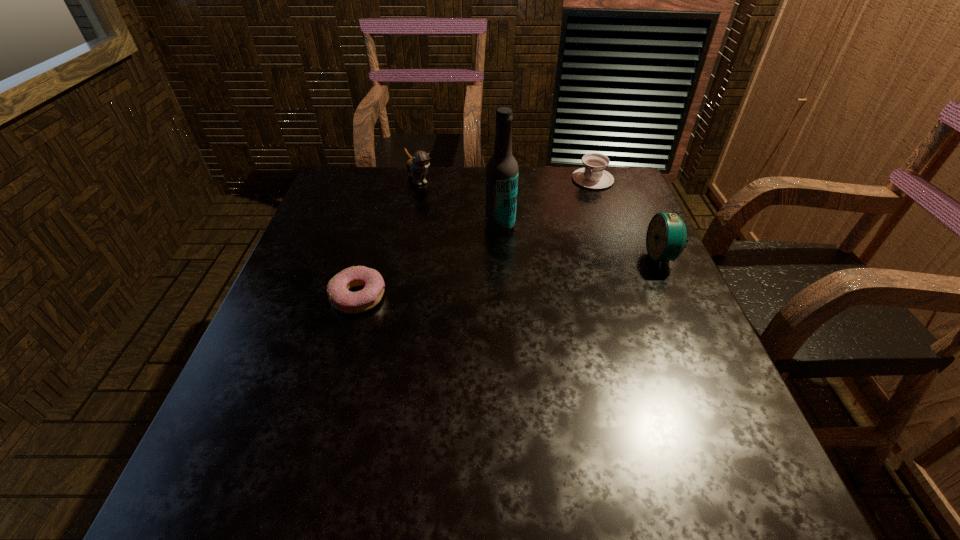
At what (x,y) coordinates should I click in order to perform the action: click on vacant space located on the handle side of the teacup. Please return your answer as a coordinate pair (x, y). Image resolution: width=960 pixels, height=540 pixels. Looking at the image, I should click on (559, 245).

Image resolution: width=960 pixels, height=540 pixels. In order to click on free region located on the handle side of the teacup in this screenshot , I will do `click(580, 205)`.

Locate an element on the screen. This screenshot has width=960, height=540. kitten that is at the far edge is located at coordinates (417, 165).

This screenshot has height=540, width=960. In order to click on teacup located in the far edge section of the desktop in this screenshot , I will do `click(593, 176)`.

Find the location of a particular element. The height and width of the screenshot is (540, 960). object at the left edge is located at coordinates pyautogui.click(x=343, y=300).

You are a GUI agent. You are given a task and a screenshot of the screen. Output one action in this format:
    pyautogui.click(x=<x>, y=<y>)
    Task: Click on the alarm clock that is at the right edge
    
    Given the screenshot: What is the action you would take?
    pyautogui.click(x=666, y=235)

Locate an element on the screen. teacup situated at the right edge is located at coordinates (593, 176).

You are a GUI agent. You are given a task and a screenshot of the screen. Output one action in this format:
    pyautogui.click(x=<x>, y=<y>)
    Task: Click on the object present at the far right corner
    This screenshot has width=960, height=540.
    Given the screenshot: What is the action you would take?
    pyautogui.click(x=593, y=176)

At what (x,y) coordinates should I click in order to perform the action: click on free space at the far edge of the desktop. Please return your answer as a coordinate pair (x, y). Image resolution: width=960 pixels, height=540 pixels. Looking at the image, I should click on (563, 203).

In order to click on vacant area at the near edge in this screenshot , I will do `click(395, 414)`.